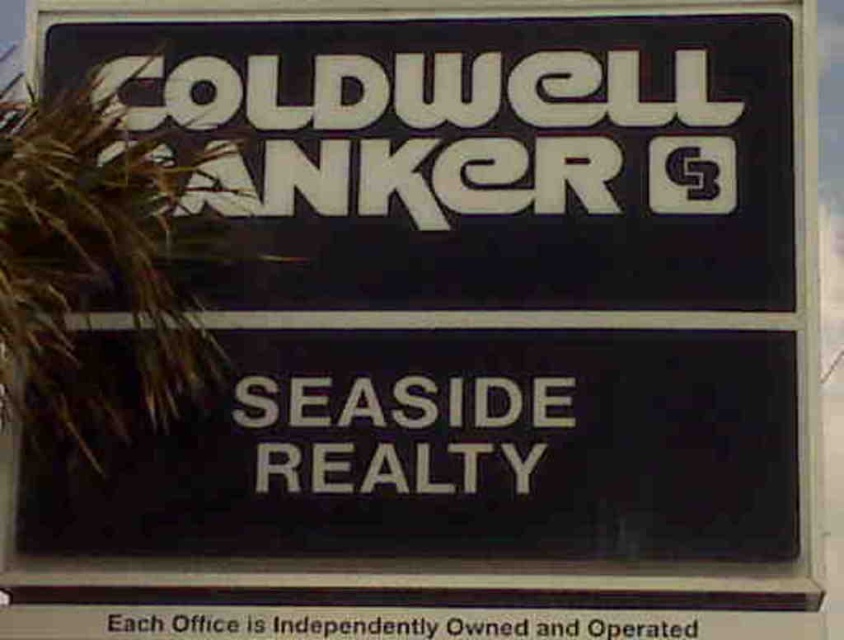
You are standing in front of the Coldwell Banker Seaside Realty signboard. Where exactly is the black matte sign at upper center located in the image?

The black matte sign at upper center is located at point (485, 154) in the image.

You are a delivery person trying to read the address on the signboard. The black matte sign at upper center and the black plastic text at lower center are both part of the signboard. Which one do you think is wider?

The black matte sign at upper center might be wider than black plastic text at lower center according to the description.

You are a pedestrian walking along the sidewalk and see the black matte sign at upper center and the white matte sign at center. Which one is positioned to the left?

The black matte sign at upper center is positioned to the left of the white matte sign at center.